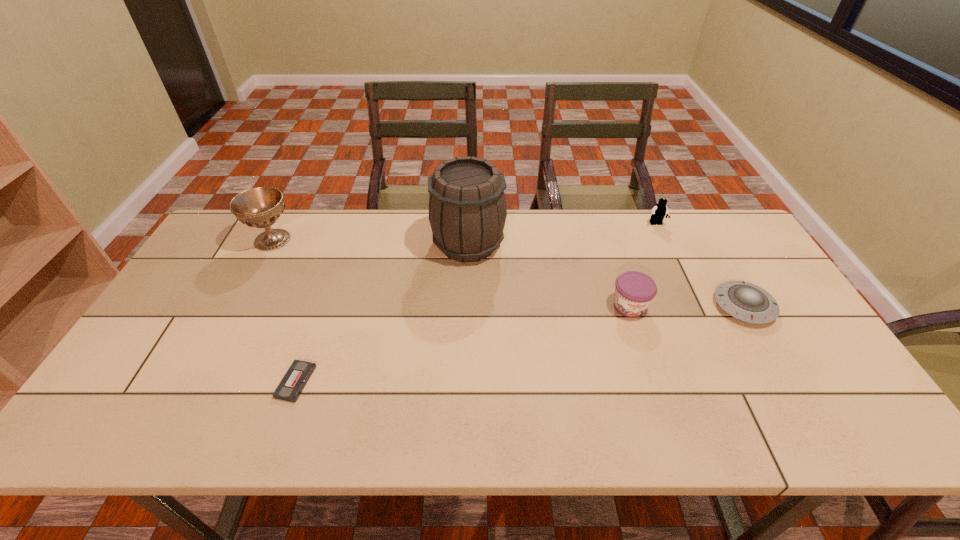
The image size is (960, 540). I want to click on object positioned at the right edge, so click(747, 302).

Image resolution: width=960 pixels, height=540 pixels. Identify the location of object situated at the far left corner. (260, 207).

In the image, there is a desktop. Identify the location of free space at the far edge. (321, 249).

You are a GUI agent. You are given a task and a screenshot of the screen. Output one action in this format:
    pyautogui.click(x=<x>, y=<y>)
    Task: Click on the vacant space at the near edge of the desktop
    
    Given the screenshot: What is the action you would take?
    pyautogui.click(x=368, y=421)

You are a GUI agent. You are given a task and a screenshot of the screen. Output one action in this format:
    pyautogui.click(x=<x>, y=<y>)
    Task: Click on the vacant region at the left edge of the desktop
    The height and width of the screenshot is (540, 960).
    Given the screenshot: What is the action you would take?
    pyautogui.click(x=176, y=325)

At what (x,y) coordinates should I click in order to perform the action: click on vacant area at the right edge. Please return your answer as a coordinate pair (x, y). The width and height of the screenshot is (960, 540). Looking at the image, I should click on coord(744,274).

At what (x,y) coordinates should I click in order to perform the action: click on free location at the far right corner of the desktop. Please return your answer as a coordinate pair (x, y). The width and height of the screenshot is (960, 540). Looking at the image, I should click on (719, 225).

I want to click on free space that is in between the second shortest object and the jam, so click(x=686, y=306).

The width and height of the screenshot is (960, 540). I want to click on unoccupied position between the wine bucket and the jam, so click(549, 275).

Find the location of a particular element. The width and height of the screenshot is (960, 540). free space between the fifth shortest object and the nearest object is located at coordinates 284,311.